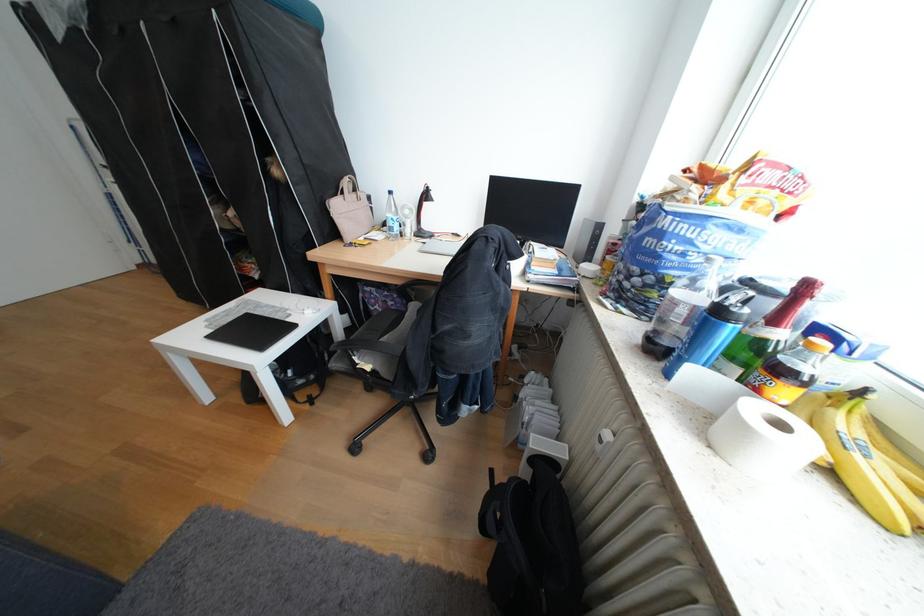
I want to click on green glass bottle, so click(x=764, y=333).